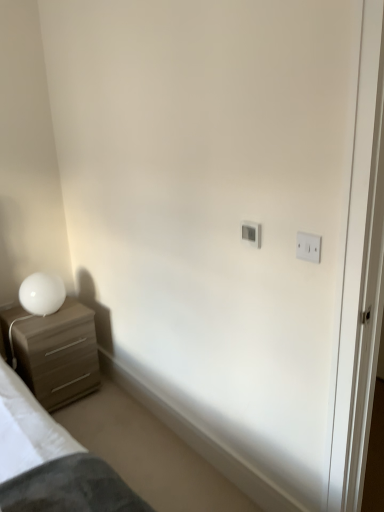
Question: Would you say white plastic light switch at upper center, acting as the 2th light switch starting from the right, is inside or outside white glossy table lamp at lower left?

Choices:
 (A) inside
 (B) outside

Answer: (B)

Question: Is point (256, 233) closer or farther from the camera than point (28, 297)?

Choices:
 (A) closer
 (B) farther

Answer: (A)

Question: Estimate the real-world distances between objects in this image. Which object is farther from the matte wood chest of drawers at left?

Choices:
 (A) white plastic light switch at upper right, positioned as the 2th light switch in back-to-front order
 (B) white glossy table lamp at lower left
 (C) white plastic light switch at upper center, acting as the 2th light switch starting from the right

Answer: (A)

Question: Considering the real-world distances, which object is farthest from the white glossy table lamp at lower left?

Choices:
 (A) white plastic light switch at upper center, the second light switch when ordered from front to back
 (B) matte wood chest of drawers at left
 (C) white plastic light switch at upper right, which is the 1th light switch from right to left

Answer: (C)